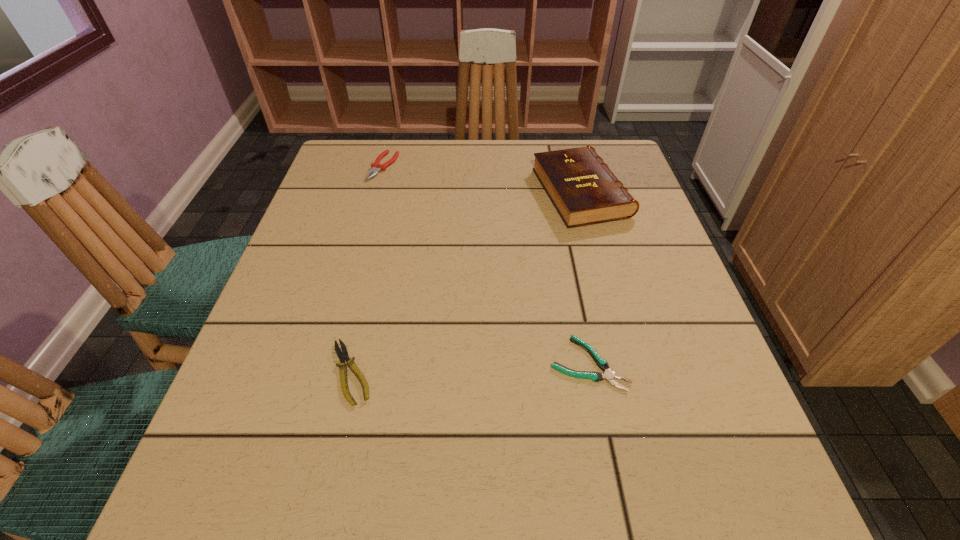
Locate an element on the screen. The image size is (960, 540). hardback book is located at coordinates (583, 189).

Where is `the farthest pliers`? Image resolution: width=960 pixels, height=540 pixels. the farthest pliers is located at coordinates (375, 166).

This screenshot has height=540, width=960. I want to click on the third shortest object, so point(375,166).

The image size is (960, 540). What are the coordinates of `the second shortest pliers` in the screenshot? It's located at (343, 355).

In order to click on the shortest pliers in this screenshot , I will do `click(609, 375)`.

Find the location of a particular element. the shortest object is located at coordinates (609, 375).

Where is `vacant region located on the back of the tallest object`? Image resolution: width=960 pixels, height=540 pixels. vacant region located on the back of the tallest object is located at coordinates (567, 141).

I want to click on free space located on the front of the third shortest object, so click(348, 295).

Identify the location of free space located on the back of the second shortest object. 383,235.

Locate an element on the screen. free space located 0.340m on the left of the shortest object is located at coordinates (351, 363).